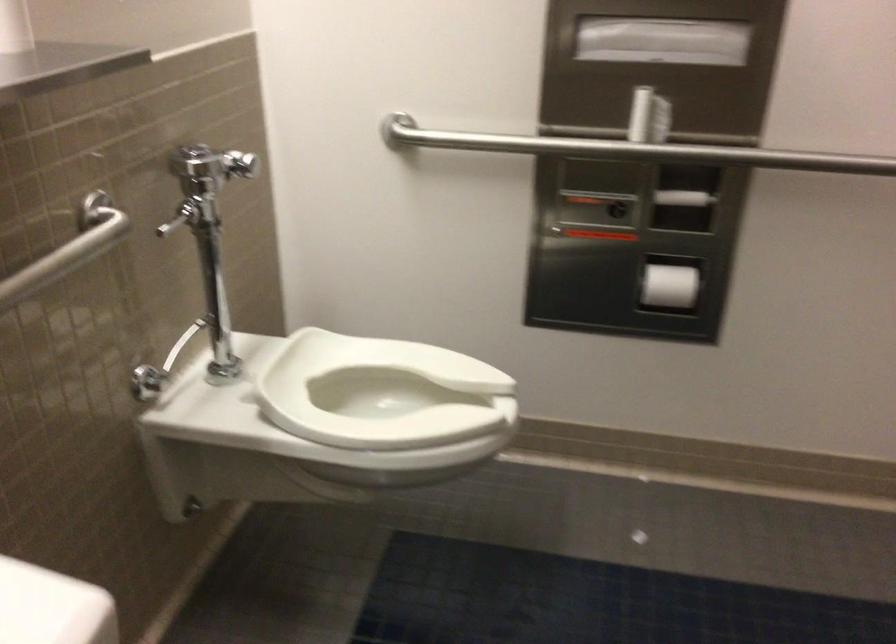
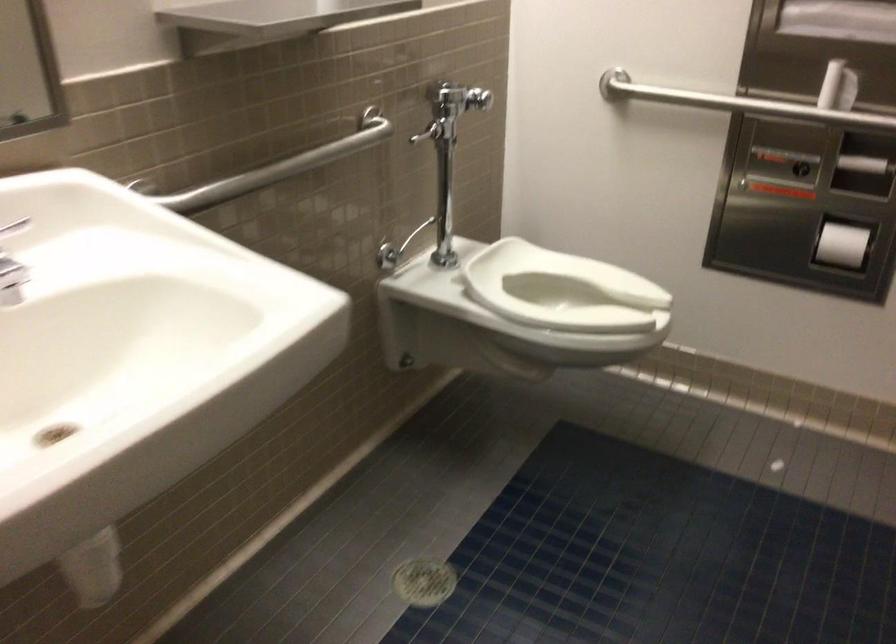
The images are taken continuously from a first-person perspective. In which direction are you moving?

The cameraman walked toward right, backward.